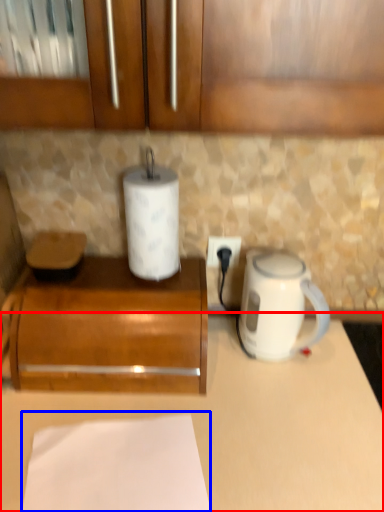
Question: Which object appears farthest to the camera in this image, counter (highlighted by a red box) or sheet (highlighted by a blue box)?

Choices:
 (A) counter
 (B) sheet

Answer: (A)